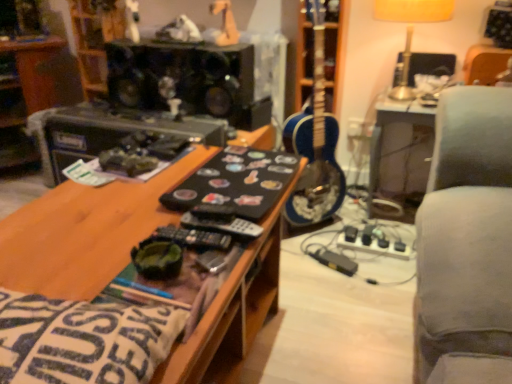
Describe the element at coordinates (315, 141) in the screenshot. Image resolution: width=512 pixels, height=384 pixels. I see `blue glossy guitar at center` at that location.

The image size is (512, 384). Describe the element at coordinates (225, 23) in the screenshot. I see `matte plastic toy at upper center, the 3th toy in the left-to-right sequence` at that location.

Measure the distance between matte plastic toy at upper center, the 3th toy in the left-to-right sequence, and camera.

matte plastic toy at upper center, the 3th toy in the left-to-right sequence, is 1.79 meters away from camera.

Find the location of `white plush toy at upper center, acting as the second toy starting from the left`. white plush toy at upper center, acting as the second toy starting from the left is located at coordinates (180, 31).

Describe the element at coordinates (82, 340) in the screenshot. I see `white fabric pillow at lower left` at that location.

Identify the location of white fabric pillow at lower left. [x=82, y=340].

In order to face matte gold table lamp at upper right, should I rotate leftwards or rightwards?

A 19.393 degree turn to the right will do.

Describe the element at coordinates (411, 29) in the screenshot. The image size is (512, 384). I see `matte gold table lamp at upper right` at that location.

Find the location of a particular element. This screenshot has height=384, width=512. white matte toy at upper center, which is counted as the third toy, starting from the right is located at coordinates (132, 20).

This screenshot has width=512, height=384. I want to click on blue glossy guitar at center, so click(315, 141).

Is blue glossy guitar at center at the right side of matte gold table lamp at upper right?

Incorrect, blue glossy guitar at center is not on the right side of matte gold table lamp at upper right.

Looking at this image, from a real-world perspective, is blue glossy guitar at center positioned over matte gold table lamp at upper right based on gravity?

Actually, blue glossy guitar at center is physically below matte gold table lamp at upper right in the real world.

Looking at their sizes, would you say blue glossy guitar at center is wider or thinner than matte gold table lamp at upper right?

Clearly, blue glossy guitar at center has less width compared to matte gold table lamp at upper right.

Between blue glossy guitar at center and matte gold table lamp at upper right, which one has larger size?

blue glossy guitar at center is bigger.

From the image's perspective, relative to white plush toy at upper center, acting as the second toy starting from the right, is matte plastic toy at upper center, the 3th toy in the left-to-right sequence, above or below?

matte plastic toy at upper center, the 3th toy in the left-to-right sequence, is below white plush toy at upper center, acting as the second toy starting from the right.

Is matte plastic toy at upper center, which is the 1th toy from right to left, looking in the opposite direction of white plush toy at upper center, acting as the second toy starting from the right?

No.

From a real-world perspective, which object stands above the other?

From a 3D spatial view, matte plastic toy at upper center, the 3th toy in the left-to-right sequence, is above.

Locate an element on the screen. toy below the white plush toy at upper center, acting as the second toy starting from the right (from the image's perspective) is located at coordinates (225, 23).

Can black plastic shelf at upper left be found inside matte plastic toy at upper center, the 3th toy in the left-to-right sequence?

That's incorrect, black plastic shelf at upper left is not inside matte plastic toy at upper center, the 3th toy in the left-to-right sequence.

Find the location of a particular element. This screenshot has width=512, height=384. shelf below the matte plastic toy at upper center, which is the 1th toy from right to left (from the image's perspective) is located at coordinates (24, 95).

From the image's perspective, would you say white matte toy at upper center, which is counted as the third toy, starting from the right, is positioned over black matte speaker at upper center?

Yes, from the image's perspective, white matte toy at upper center, which is counted as the third toy, starting from the right, is over black matte speaker at upper center.

Looking at their sizes, would you say white matte toy at upper center, which is counted as the third toy, starting from the right, is wider or thinner than black matte speaker at upper center?

In the image, white matte toy at upper center, which is counted as the third toy, starting from the right, appears to be more narrow than black matte speaker at upper center.

You are a GUI agent. You are given a task and a screenshot of the screen. Output one action in this format:
    pyautogui.click(x=<x>, y=<y>)
    Task: Click on the speaker below the white matte toy at upper center, which is counted as the third toy, starting from the right (from the image's perspective)
    This screenshot has width=512, height=384.
    Given the screenshot: What is the action you would take?
    184,78

Looking at this image, between white plush toy at upper center, acting as the second toy starting from the left, and black plastic shelf at upper left, which one appears on the right side from the viewer's perspective?

From the viewer's perspective, white plush toy at upper center, acting as the second toy starting from the left, appears more on the right side.

From a real-world perspective, which object rests below the other?

black plastic shelf at upper left is physically lower.

Is white plush toy at upper center, acting as the second toy starting from the right, next to black plastic shelf at upper left and touching it?

white plush toy at upper center, acting as the second toy starting from the right, is not next to black plastic shelf at upper left, and they're not touching.

Is point (170, 33) positioned after point (39, 108)?

No, (170, 33) is closer to viewer.

Looking at this image, between blue glossy guitar at center and white plush toy at upper center, acting as the second toy starting from the left, which one appears on the left side from the viewer's perspective?

A: From the viewer's perspective, white plush toy at upper center, acting as the second toy starting from the left, appears more on the left side.

From the picture: Is blue glossy guitar at center surrounding white plush toy at upper center, acting as the second toy starting from the right?

No, white plush toy at upper center, acting as the second toy starting from the right, is not surrounded by blue glossy guitar at center.

Between blue glossy guitar at center and white plush toy at upper center, acting as the second toy starting from the right, which one has larger size?

blue glossy guitar at center is bigger.

From the image's perspective, who appears lower, blue glossy guitar at center or white plush toy at upper center, acting as the second toy starting from the right?

blue glossy guitar at center, from the image's perspective.

Does matte gold table lamp at upper right appear on the right side of matte plastic toy at upper center, which is the 1th toy from right to left?

Indeed, matte gold table lamp at upper right is positioned on the right side of matte plastic toy at upper center, which is the 1th toy from right to left.

From the image's perspective, between matte gold table lamp at upper right and matte plastic toy at upper center, which is the 1th toy from right to left, which one is located above?

matte plastic toy at upper center, which is the 1th toy from right to left.

How many degrees apart are the facing directions of matte gold table lamp at upper right and matte plastic toy at upper center, which is the 1th toy from right to left?

They differ by 17.2 degrees in their facing directions.

Considering the relative sizes of matte gold table lamp at upper right and matte plastic toy at upper center, which is the 1th toy from right to left, in the image provided, is matte gold table lamp at upper right taller than matte plastic toy at upper center, which is the 1th toy from right to left,?

Yes, matte gold table lamp at upper right is taller than matte plastic toy at upper center, which is the 1th toy from right to left.

Where is `guitar that appears below the matte gold table lamp at upper right (from the image's perspective)`? The image size is (512, 384). guitar that appears below the matte gold table lamp at upper right (from the image's perspective) is located at coordinates (315, 141).

There is a white plush toy at upper center, acting as the second toy starting from the left. Where is `the 2nd toy above it (from a real-world perspective)`? The height and width of the screenshot is (384, 512). the 2nd toy above it (from a real-world perspective) is located at coordinates (225, 23).

When comparing their distances from black matte remote at center, does matte gold table lamp at upper right or matte plastic toy at upper center, which is the 1th toy from right to left, seem closer?

Based on the image, matte gold table lamp at upper right appears to be nearer to black matte remote at center.

Looking at this image, looking at the image, which one is located further to matte gold table lamp at upper right, matte plastic toy at upper center, the 3th toy in the left-to-right sequence, or blue glossy guitar at center?

The object further to matte gold table lamp at upper right is matte plastic toy at upper center, the 3th toy in the left-to-right sequence.

From the image, which object appears to be farther from white plush toy at upper center, acting as the second toy starting from the right, white matte toy at upper center, which is counted as the first toy, starting from the left, or matte gold table lamp at upper right?

matte gold table lamp at upper right is positioned further to the anchor white plush toy at upper center, acting as the second toy starting from the right.

Considering their positions, is matte plastic toy at upper center, which is the 1th toy from right to left, positioned further to white matte toy at upper center, which is counted as the third toy, starting from the right, than white plush toy at upper center, acting as the second toy starting from the left?

matte plastic toy at upper center, which is the 1th toy from right to left, is further to white matte toy at upper center, which is counted as the third toy, starting from the right.

When comparing their distances from matte gold table lamp at upper right, does blue glossy guitar at center or black matte remote at center seem further?

black matte remote at center is positioned further to the anchor matte gold table lamp at upper right.

When comparing their distances from black plastic shelf at upper left, does black matte remote at center or black matte speaker at upper center seem closer?

black matte speaker at upper center is closer to black plastic shelf at upper left.

Looking at the image, which one is located closer to white fabric pillow at lower left, black plastic shelf at upper left or black matte remote at center?

A: black matte remote at center.

Based on their spatial positions, is black matte speaker at upper center or white matte toy at upper center, which is counted as the first toy, starting from the left, further from matte plastic toy at upper center, which is the 1th toy from right to left?

white matte toy at upper center, which is counted as the first toy, starting from the left.

You are a GUI agent. You are given a task and a screenshot of the screen. Output one action in this format:
    pyautogui.click(x=<x>, y=<y>)
    Task: Click on the speaker between white plush toy at upper center, acting as the second toy starting from the right, and matte gold table lamp at upper right from left to right
    This screenshot has height=384, width=512.
    Given the screenshot: What is the action you would take?
    pyautogui.click(x=184, y=78)

I want to click on control between white fabric pillow at lower left and white plush toy at upper center, acting as the second toy starting from the right, in the front-back direction, so click(x=193, y=238).

At what (x,y) coordinates should I click in order to perform the action: click on control located between matte plastic toy at upper center, which is the 1th toy from right to left, and matte gold table lamp at upper right in the left-right direction. Please return your answer as a coordinate pair (x, y). The image size is (512, 384). Looking at the image, I should click on (193, 238).

Locate an element on the screen. This screenshot has width=512, height=384. speaker between white matte toy at upper center, which is counted as the first toy, starting from the left, and matte plastic toy at upper center, the 3th toy in the left-to-right sequence, in the horizontal direction is located at coordinates (184, 78).